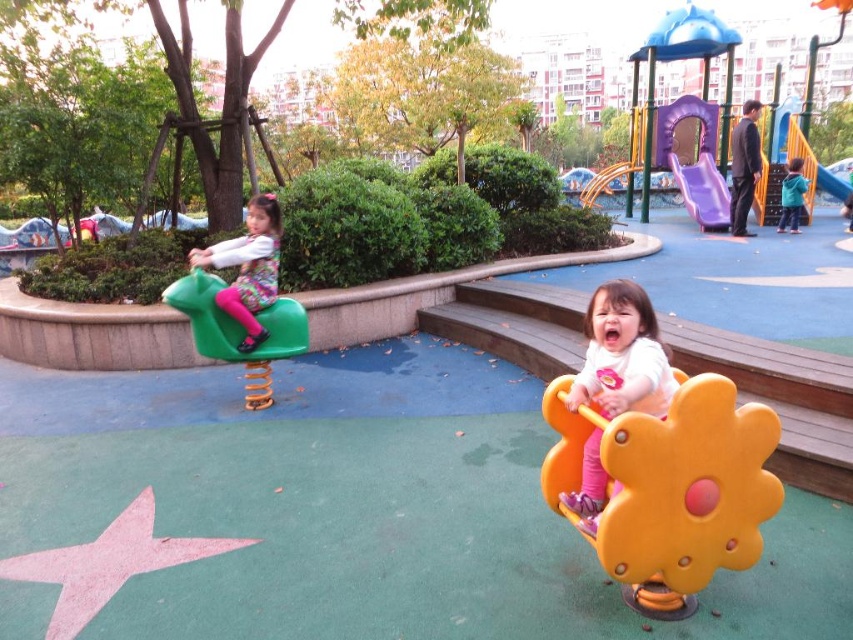
You are a parent standing near the playground entrance and want to ensure your child can reach the purple matte slide at upper right from the matte yellow swing at center. Since the slide is higher, you need to know if the path between them is clear. Is there any obstruction between the two?

The matte yellow swing at center is closer to the viewer than the purple matte slide at upper right, so there might be an obstruction between them. Check the space between the two before proceeding.